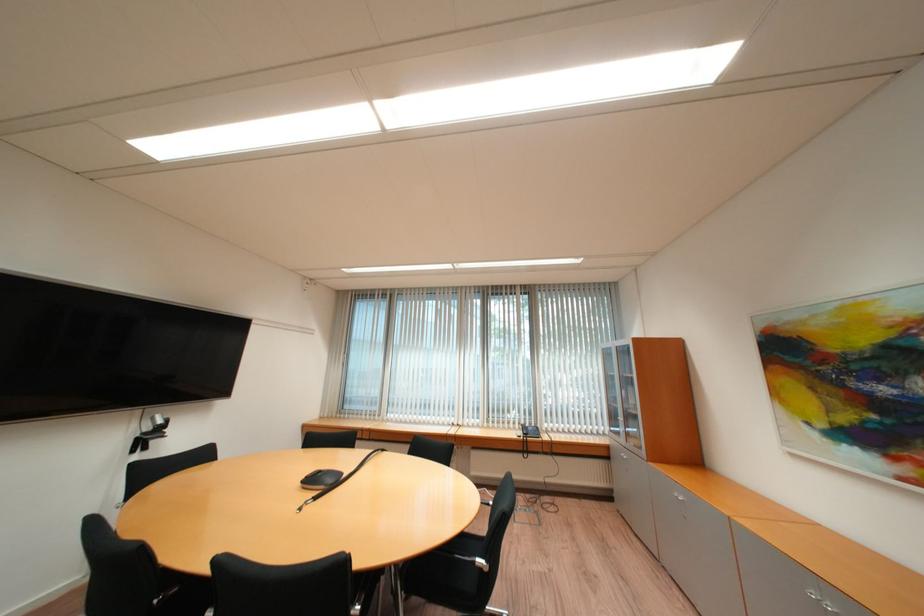
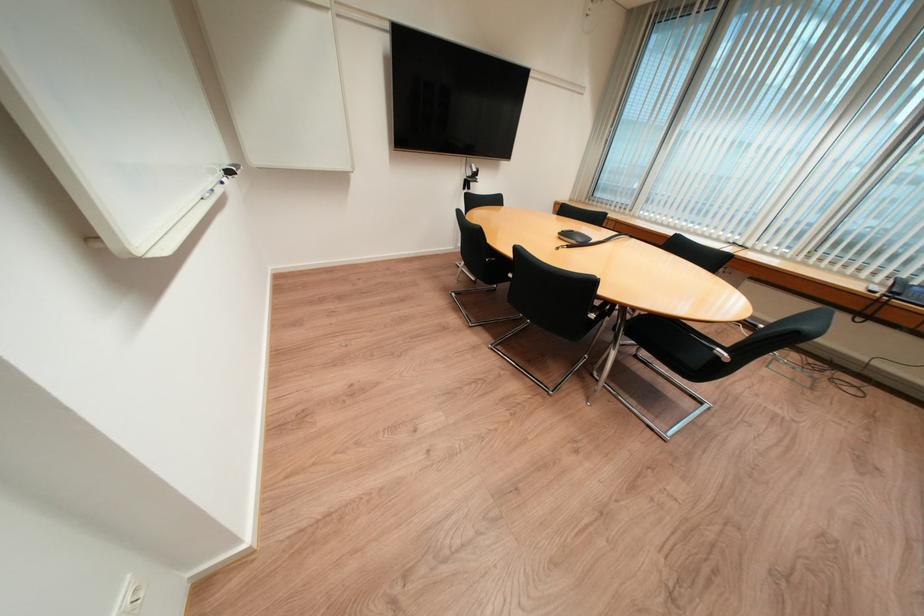
Locate, in the second image, the point that corresponds to (x=490, y=570) in the first image.

(725, 359)